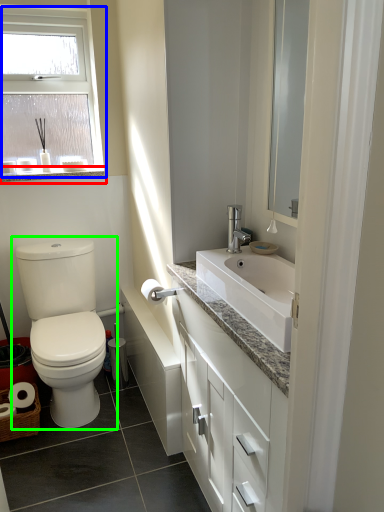
Question: Based on their relative distances, which object is nearer to window sill (highlighted by a red box)? Choose from window (highlighted by a blue box) and toilet (highlighted by a green box).

Choices:
 (A) window
 (B) toilet

Answer: (A)